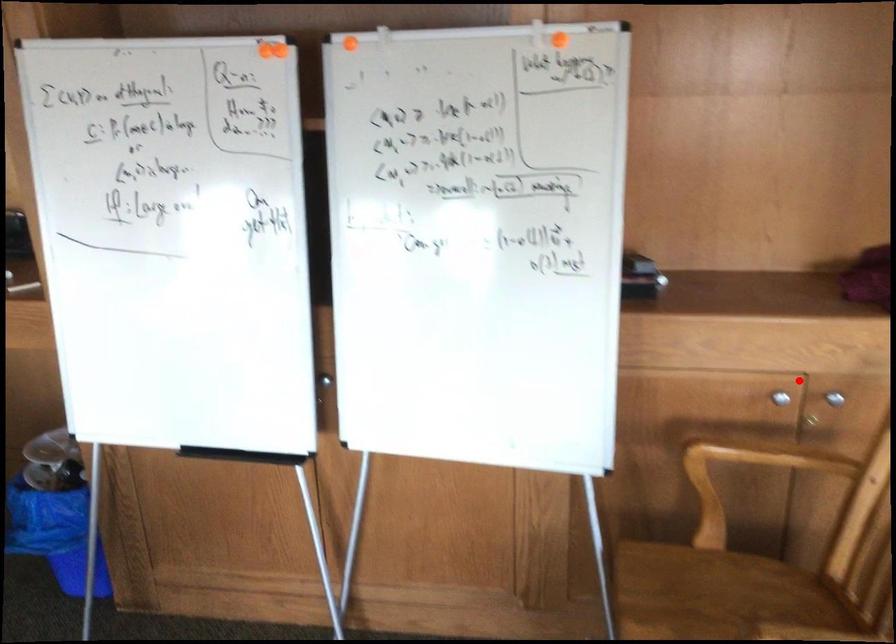
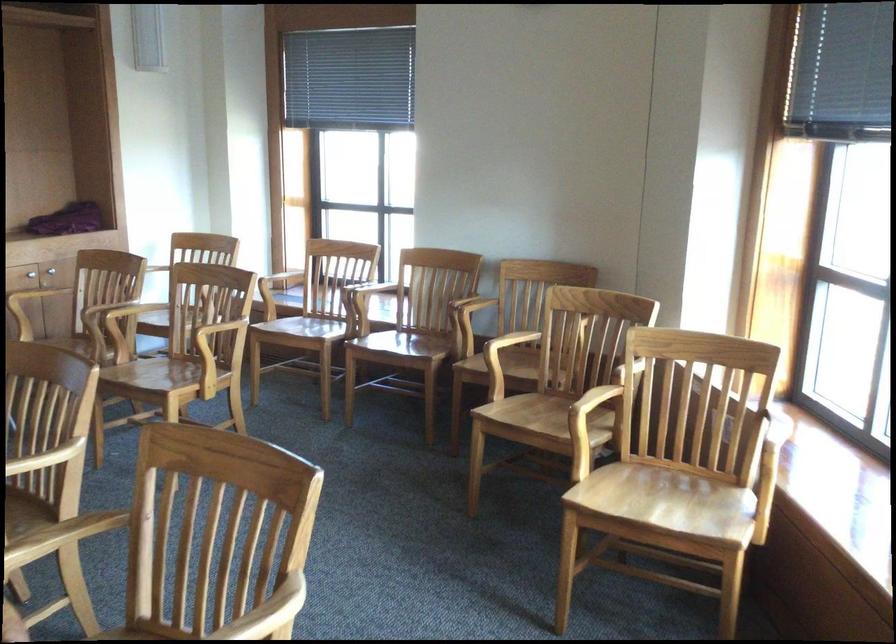
Question: I am providing you with two images of the same scene from different viewpoints. A red point is shown in image1. For the corresponding object point in image2, is it positioned nearer or farther from the camera?

Choices:
 (A) Nearer
 (B) Farther

Answer: (B)